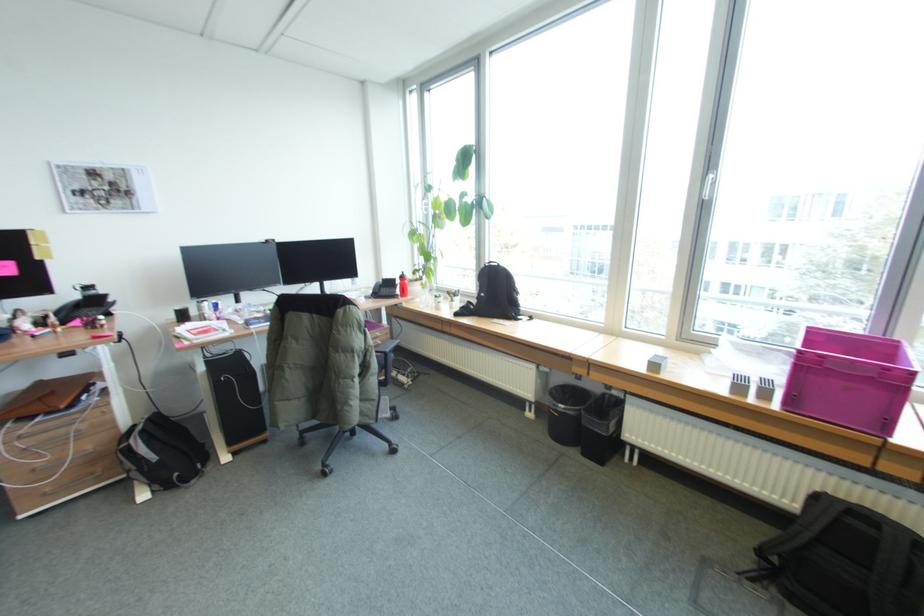
Find where to lift the magenta plastic crate. Please return your answer as a coordinate pair (x, y).

(849, 379)